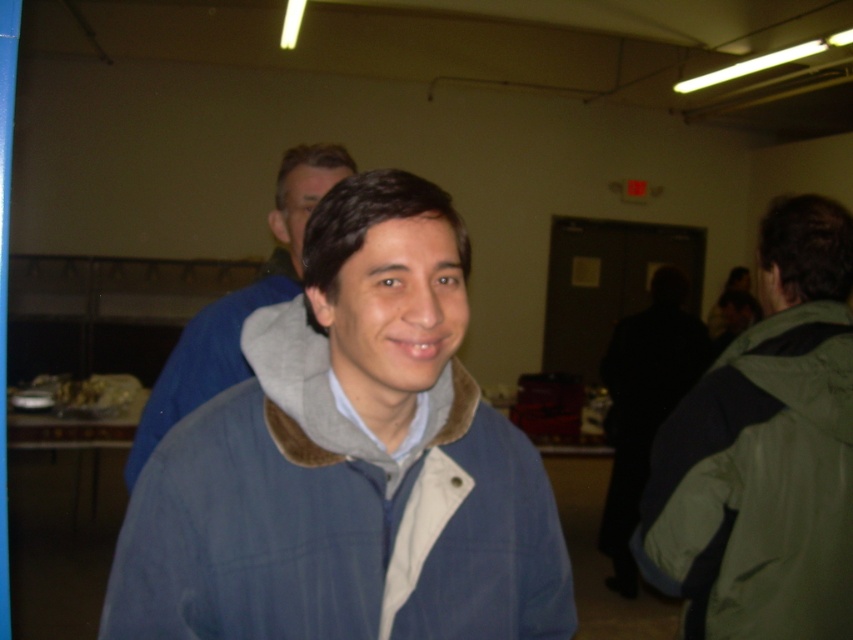
Does green matte jacket at right appear over blue fleece jacket at center?

No.

Is point (637, 560) closer to viewer compared to point (135, 480)?

Yes, it is in front of point (135, 480).

Where is `green matte jacket at right`? The width and height of the screenshot is (853, 640). green matte jacket at right is located at coordinates (759, 484).

Does blue corduroy jacket at center appear under blue fleece jacket at center?

Indeed, blue corduroy jacket at center is positioned under blue fleece jacket at center.

Is blue corduroy jacket at center smaller than blue fleece jacket at center?

A: Yes, blue corduroy jacket at center is smaller than blue fleece jacket at center.

This screenshot has height=640, width=853. Find the location of `blue corduroy jacket at center`. blue corduroy jacket at center is located at coordinates (335, 515).

Can you confirm if blue corduroy jacket at center is bigger than green matte jacket at right?

Incorrect, blue corduroy jacket at center is not larger than green matte jacket at right.

Between blue corduroy jacket at center and green matte jacket at right, which one is positioned higher?

blue corduroy jacket at center

Between point (393, 576) and point (811, 531), which one is positioned behind?

Point (811, 531)

The image size is (853, 640). In order to click on blue corduroy jacket at center in this screenshot , I will do (335, 515).